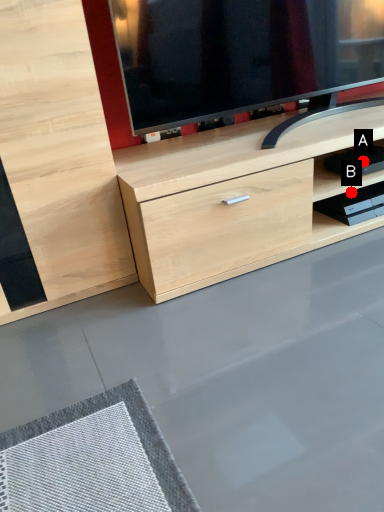
Question: Two points are circled on the image, labeled by A and B beside each circle. Among these points, which one is nearest to the camera?

Choices:
 (A) A is closer
 (B) B is closer

Answer: (A)